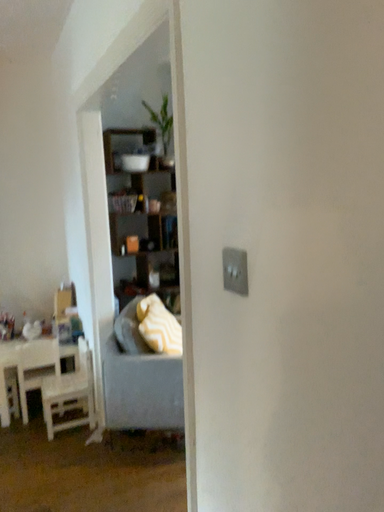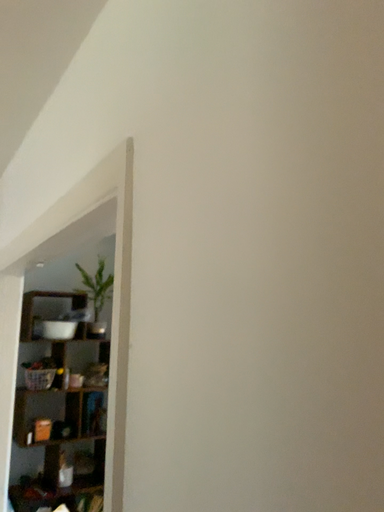
Question: Which way did the camera rotate in the video?

Choices:
 (A) rotated left
 (B) rotated right

Answer: (B)